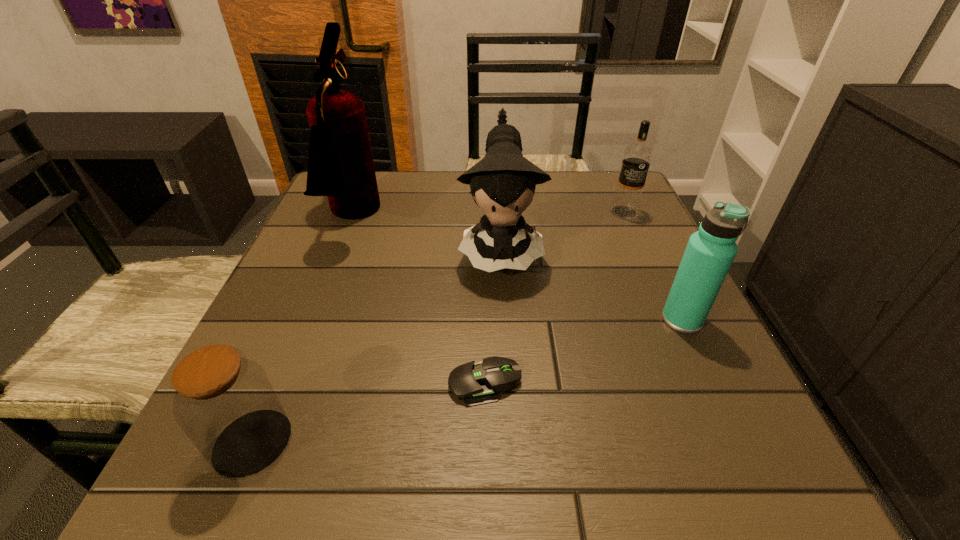
This screenshot has height=540, width=960. What are the coordinates of `thermos bottle at the right edge` in the screenshot? It's located at (709, 254).

Locate an element on the screen. vodka at the right edge is located at coordinates click(x=637, y=157).

At what (x,y) coordinates should I click in order to perform the action: click on object present at the far left corner. Please return your answer as a coordinate pair (x, y). The width and height of the screenshot is (960, 540). Looking at the image, I should click on pyautogui.click(x=340, y=165).

Locate an element on the screen. object that is at the near left corner is located at coordinates (224, 402).

Find the location of a particular element. object located at the far right corner is located at coordinates (637, 157).

Locate an element on the screen. The width and height of the screenshot is (960, 540). free space at the far edge of the desktop is located at coordinates (452, 194).

This screenshot has width=960, height=540. Identify the location of free spot at the near edge of the desktop. (431, 477).

In the image, there is a desktop. Identify the location of free space at the left edge. The image size is (960, 540). (353, 261).

In the image, there is a desktop. Identify the location of vacant space at the right edge. Image resolution: width=960 pixels, height=540 pixels. (727, 367).

This screenshot has height=540, width=960. In order to click on vacant space at the far right corner in this screenshot , I will do `click(579, 175)`.